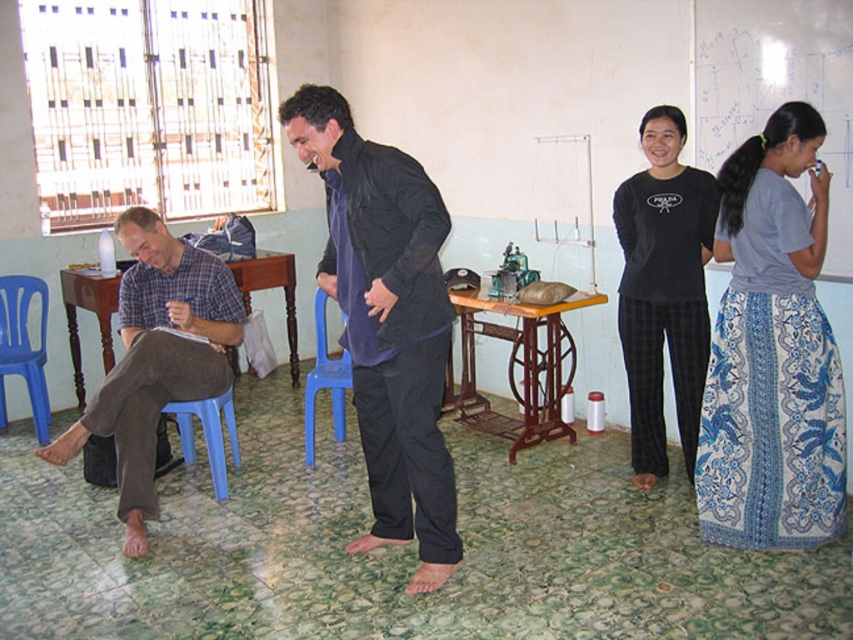
Does black cotton pants at center appear on the left side of blue plastic chair at left?

Incorrect, black cotton pants at center is not on the left side of blue plastic chair at left.

In the scene shown: Which is more to the right, black cotton pants at center or blue plastic chair at left?

black cotton pants at center is more to the right.

Which is in front, point (693, 301) or point (26, 380)?

Point (693, 301) is more forward.

Where is `black cotton pants at center`? This screenshot has height=640, width=853. black cotton pants at center is located at coordinates (663, 291).

Describe the element at coordinates (772, 353) in the screenshot. The width and height of the screenshot is (853, 640). I see `blue printed skirt at right` at that location.

Between point (813, 188) and point (312, 307), which one is positioned in front?

Positioned in front is point (813, 188).

You are a GUI agent. You are given a task and a screenshot of the screen. Output one action in this format:
    pyautogui.click(x=<x>, y=<y>)
    Task: Click on the blue printed skirt at right
    Image resolution: width=853 pixels, height=640 pixels.
    Given the screenshot: What is the action you would take?
    pyautogui.click(x=772, y=353)

At what (x,y) coordinates should I click in order to perform the action: click on blue printed skirt at right. Please return your answer as a coordinate pair (x, y). Image resolution: width=853 pixels, height=640 pixels. Looking at the image, I should click on (772, 353).

Between blue printed skirt at right and dark blue fabric shirt at center, which one has more height?

With more height is dark blue fabric shirt at center.

Locate an element on the screen. The height and width of the screenshot is (640, 853). blue printed skirt at right is located at coordinates (772, 353).